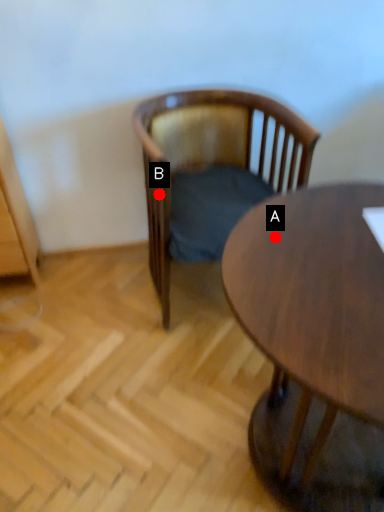
Question: Two points are circled on the image, labeled by A and B beside each circle. Which point is closer to the camera?

Choices:
 (A) A is closer
 (B) B is closer

Answer: (A)